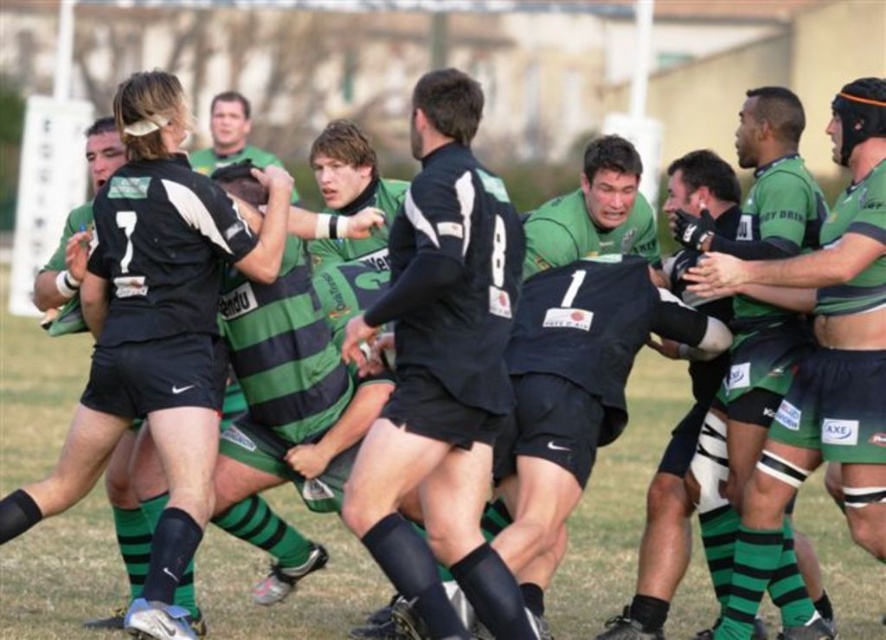
Question: Which point is farther to the camera?

Choices:
 (A) matte black jersey at center
 (B) green striped jersey at center

Answer: (B)

Question: Does matte black jersey at center have a greater width compared to green striped jersey at center?

Choices:
 (A) no
 (B) yes

Answer: (B)

Question: Among these objects, which one is nearest to the camera?

Choices:
 (A) matte black jersey at center
 (B) green striped jersey at center

Answer: (A)

Question: Can you confirm if matte black jersey at center is positioned to the right of green striped jersey at center?

Choices:
 (A) no
 (B) yes

Answer: (A)

Question: Among these points, which one is farthest from the camera?

Choices:
 (A) click(x=801, y=593)
 (B) click(x=395, y=282)

Answer: (A)

Question: Is matte black jersey at center positioned before green striped jersey at center?

Choices:
 (A) no
 (B) yes

Answer: (B)